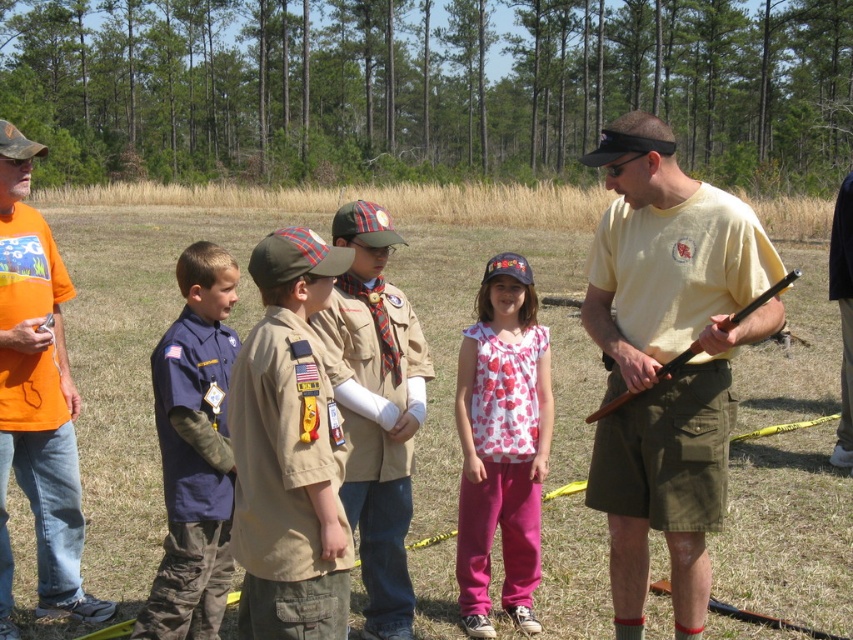
Between yellow cotton shirt at right and khaki uniform at center, which one has more height?

yellow cotton shirt at right is taller.

Who is more forward, (x=619, y=145) or (x=300, y=586)?

Point (x=300, y=586) is more forward.

Which is behind, point (717, 244) or point (274, 564)?

The point (717, 244) is more distant.

This screenshot has height=640, width=853. Find the location of `yellow cotton shirt at right`. yellow cotton shirt at right is located at coordinates (666, 358).

Does brown uniform at center appear under white heart-patterned blouse at center?

Yes, brown uniform at center is below white heart-patterned blouse at center.

Measure the distance between point (363, 419) and camera.

The distance of point (363, 419) from camera is 4.55 meters.

Identify the location of brown uniform at center. (375, 408).

This screenshot has width=853, height=640. Find the location of `khaki uniform at center`. khaki uniform at center is located at coordinates (288, 451).

Can you confirm if khaki uniform at center is thinner than wooden shotgun at right?

Correct, khaki uniform at center's width is less than wooden shotgun at right's.

In order to click on khaki uniform at center in this screenshot , I will do `click(288, 451)`.

You are a GUI agent. You are given a task and a screenshot of the screen. Output one action in this format:
    pyautogui.click(x=<x>, y=<y>)
    Task: Click on the khaki uniform at center
    
    Given the screenshot: What is the action you would take?
    (288, 451)